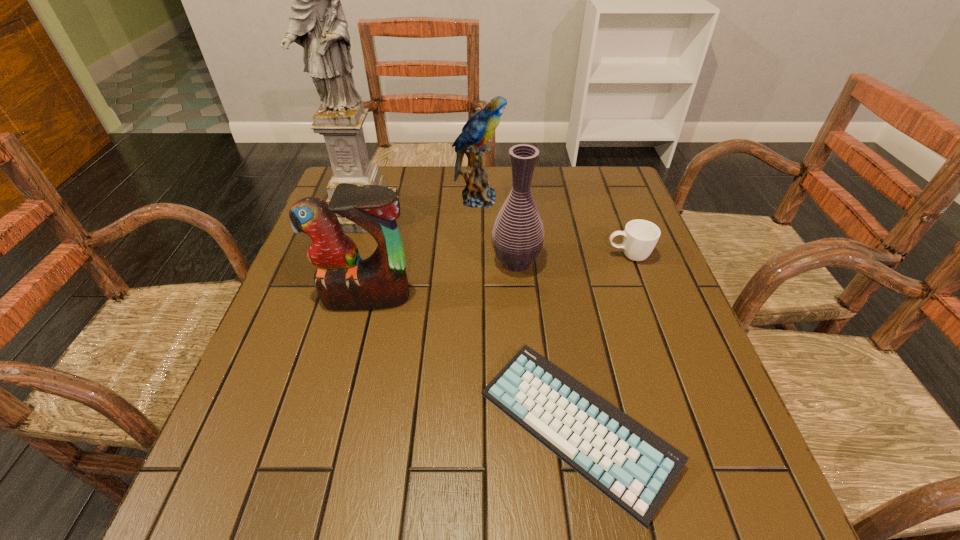
Where is `vacant space at the far right corner of the desktop`? This screenshot has height=540, width=960. vacant space at the far right corner of the desktop is located at coordinates (605, 201).

You are a GUI agent. You are given a task and a screenshot of the screen. Output one action in this format:
    pyautogui.click(x=<x>, y=<y>)
    Task: Click on the unoccupied position between the right parrot and the tallest object
    
    Given the screenshot: What is the action you would take?
    pyautogui.click(x=420, y=206)

Identify the location of free spot between the nearest object and the tallest object. The image size is (960, 540). (468, 321).

The width and height of the screenshot is (960, 540). Identify the location of unoccupied position between the cup and the computer keyboard. (602, 342).

Identify the location of vacant space in between the farther parrot and the nearest object. (527, 313).

At what (x,y) coordinates should I click in order to perform the action: click on vacant area between the shortest object and the cup. Please return your answer as a coordinate pair (x, y). Looking at the image, I should click on (602, 342).

The width and height of the screenshot is (960, 540). Find the location of `vacant region between the tallest object and the nearer parrot`. vacant region between the tallest object and the nearer parrot is located at coordinates (364, 255).

Image resolution: width=960 pixels, height=540 pixels. In order to click on free space between the vase and the sculpture in this screenshot , I will do `click(439, 238)`.

At what (x,y) coordinates should I click in order to perform the action: click on empty space between the fifth tallest object and the farther parrot. Please return your answer as a coordinate pair (x, y). This screenshot has width=960, height=540. Looking at the image, I should click on (553, 227).

The height and width of the screenshot is (540, 960). I want to click on free space between the left parrot and the cup, so click(497, 276).